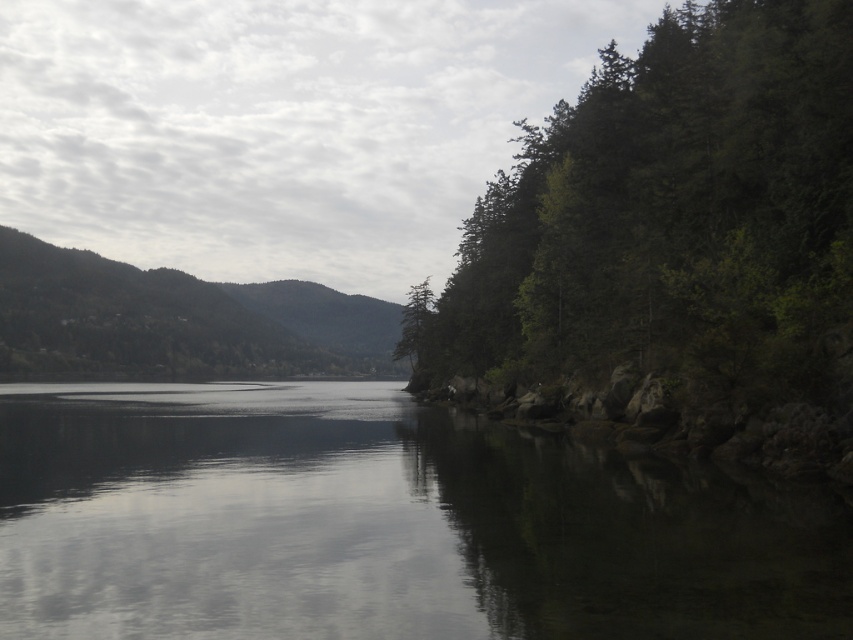
Question: Can you confirm if green matte tree at right is smaller than green matte tree at center?

Choices:
 (A) yes
 (B) no

Answer: (B)

Question: From the image, what is the correct spatial relationship of smooth dark water at center in relation to green matte tree at right?

Choices:
 (A) above
 (B) below

Answer: (B)

Question: Which point is closer to the camera taking this photo?

Choices:
 (A) (22, 246)
 (B) (527, 228)
 (C) (79, 502)
 (D) (410, 333)

Answer: (C)

Question: Which of these objects is positioned farthest from the smooth dark water at center?

Choices:
 (A) green matte tree at center
 (B) green forested mountain at left

Answer: (B)

Question: Can you confirm if green matte tree at right is bigger than green forested mountain at left?

Choices:
 (A) yes
 (B) no

Answer: (A)

Question: Which point is farther from the camera taking this photo?

Choices:
 (A) (474, 593)
 (B) (427, 276)
 (C) (196, 288)
 (D) (839, 272)

Answer: (B)